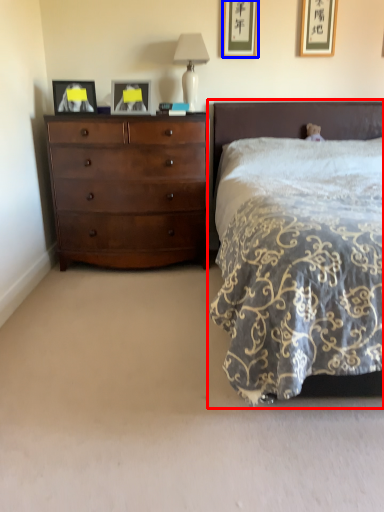
Question: Among these objects, which one is nearest to the camera, bed (highlighted by a red box) or picture frame (highlighted by a blue box)?

Choices:
 (A) bed
 (B) picture frame

Answer: (A)